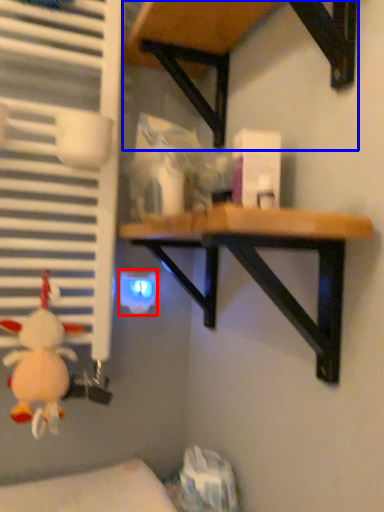
Question: Among these objects, which one is nearest to the camera, electric outlet (highlighted by a red box) or table (highlighted by a blue box)?

Choices:
 (A) electric outlet
 (B) table

Answer: (B)